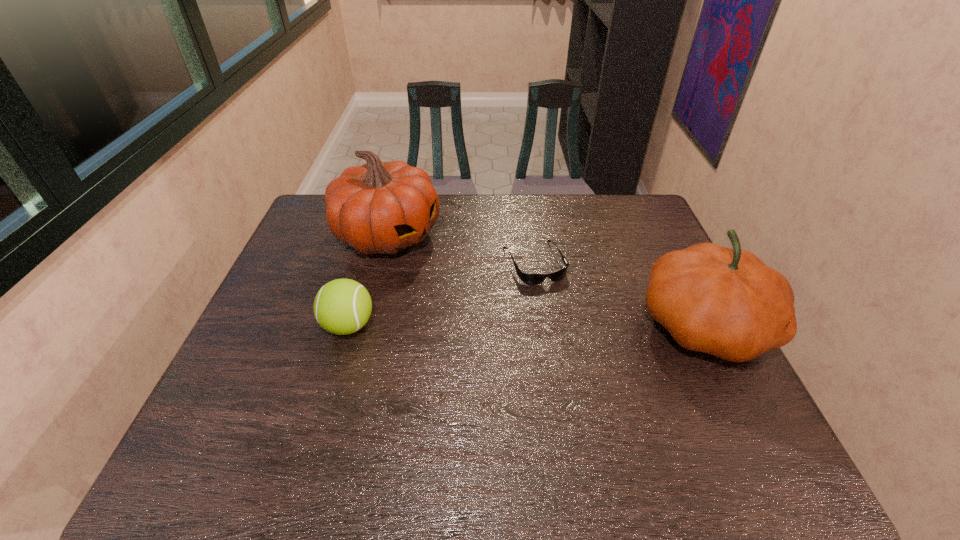
This screenshot has width=960, height=540. In order to click on the second shortest object in this screenshot , I will do 343,306.

Where is `the right pumpkin`? This screenshot has width=960, height=540. the right pumpkin is located at coordinates (726, 302).

Locate an element on the screen. Image resolution: width=960 pixels, height=540 pixels. the nearer pumpkin is located at coordinates (726, 302).

Where is `the left pumpkin`? the left pumpkin is located at coordinates (381, 207).

Find the location of a particular element. The image size is (960, 540). sunglasses is located at coordinates (528, 278).

Identify the location of the shortest object. (528, 278).

I want to click on vacant position located 0.340m on the back of the tennis ball, so tap(376, 231).

This screenshot has height=540, width=960. I want to click on blank area located on the face of the left pumpkin, so click(x=441, y=261).

Where is `vacant region located on the face of the left pumpkin`? vacant region located on the face of the left pumpkin is located at coordinates (459, 271).

Identify the location of vacant space located on the face of the left pumpkin. (486, 285).